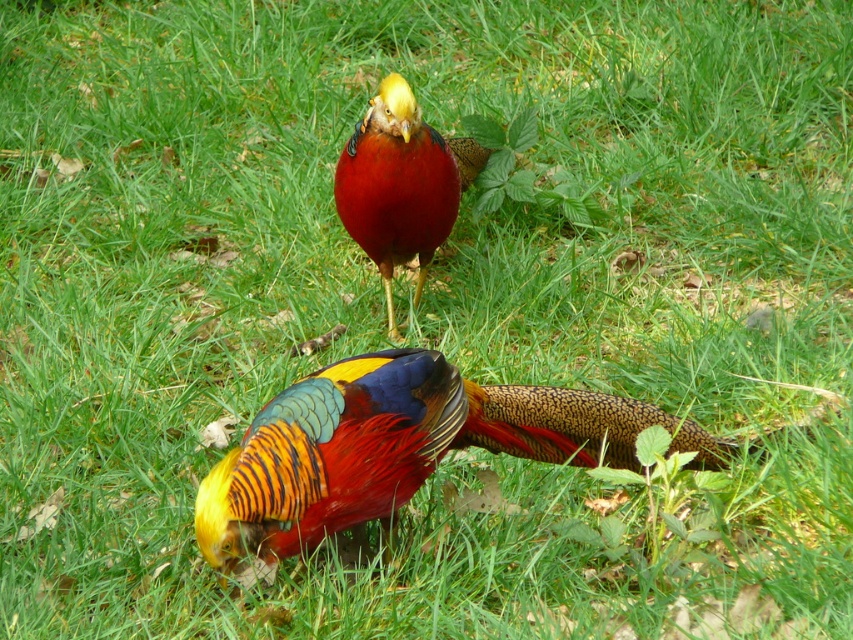
Question: Which object is farther from the camera taking this photo?

Choices:
 (A) glossy red pheasant at center
 (B) shiny multicolored bird at center

Answer: (A)

Question: Can you confirm if shiny multicolored bird at center is thinner than glossy red pheasant at center?

Choices:
 (A) yes
 (B) no

Answer: (B)

Question: Does shiny multicolored bird at center appear on the right side of glossy red pheasant at center?

Choices:
 (A) no
 (B) yes

Answer: (B)

Question: Is shiny multicolored bird at center further to camera compared to glossy red pheasant at center?

Choices:
 (A) yes
 (B) no

Answer: (B)